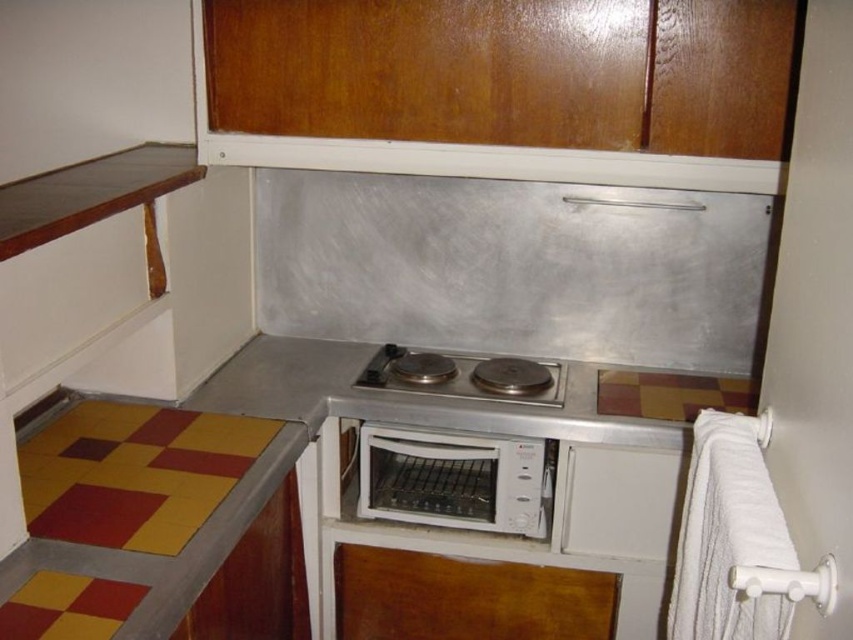
You are trying to place a new kitchen gadget that requires 12 inches of space. You have the white plastic toaster oven at center and the stainless steel cooktop at center in your kitchen. Which appliance can accommodate the gadget if placed next to it without exceeding the space?

The stainless steel cooktop at center has a greater width than the white plastic toaster oven at center, so placing the gadget next to the stainless steel cooktop at center would provide enough space since it is wider and can accommodate the 12 inches requirement.

You are standing in the kitchenette and want to reach the point at coordinates point (474,435). If your arm can extend 5 feet, can you reach it?

The point (474,435) is 5.78 feet from the viewer, which is beyond the 5 feet arm reach, so you cannot reach it.